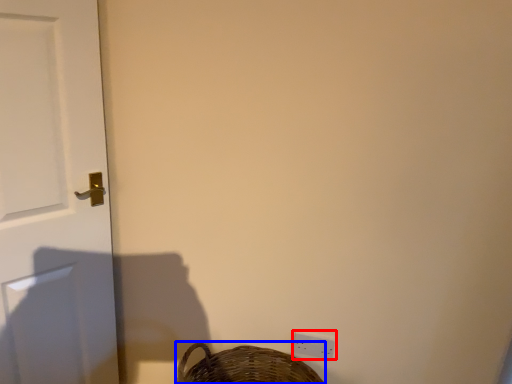
Question: Which of the following is the closest to the observer, light switch (highlighted by a red box) or basket (highlighted by a blue box)?

Choices:
 (A) light switch
 (B) basket

Answer: (B)